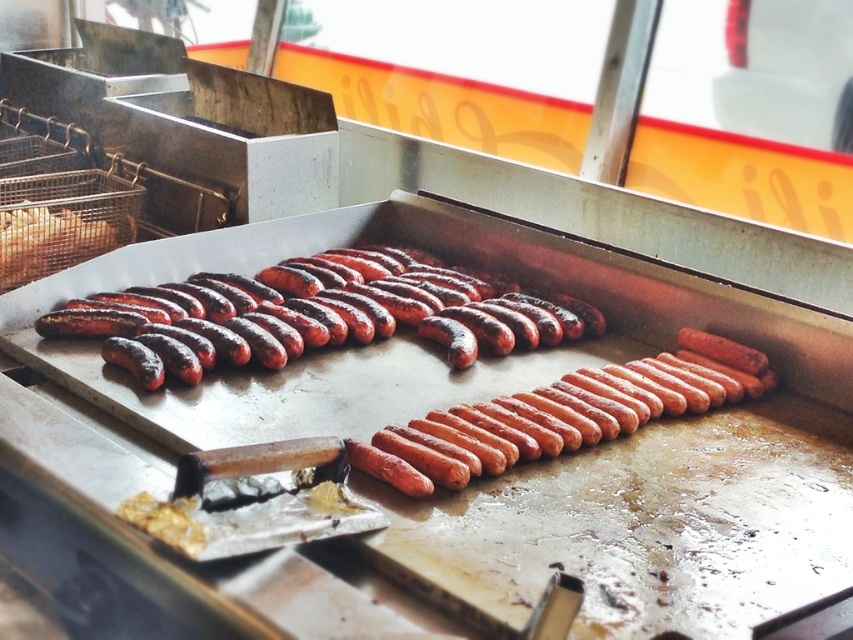
Does charred glossy sausages at center appear on the left side of shiny metallic hot dog at left?

No, charred glossy sausages at center is not to the left of shiny metallic hot dog at left.

This screenshot has height=640, width=853. What do you see at coordinates (314, 314) in the screenshot?
I see `charred glossy sausages at center` at bounding box center [314, 314].

Which is in front, point (419, 326) or point (67, 227)?

Point (419, 326) is more forward.

Image resolution: width=853 pixels, height=640 pixels. What are the coordinates of `charred glossy sausages at center` in the screenshot? It's located at (314, 314).